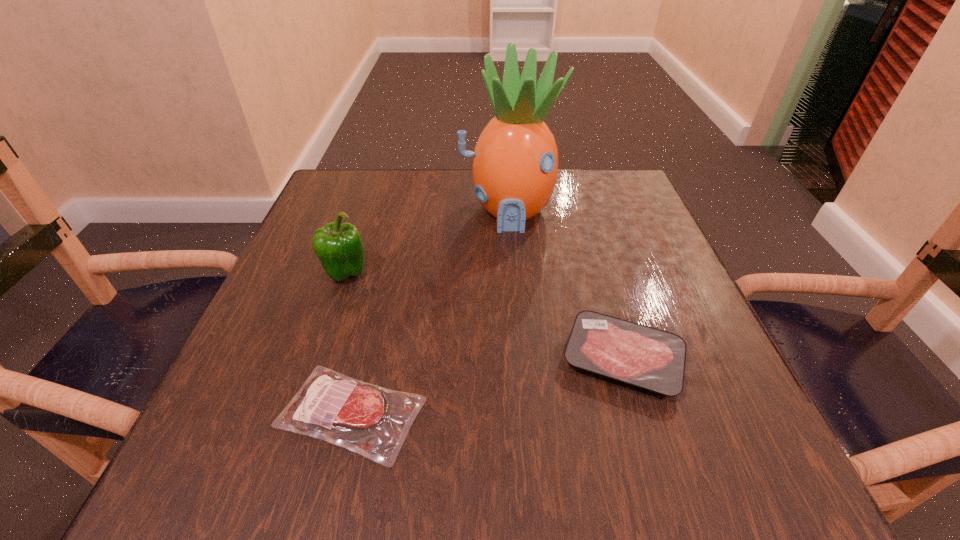
Image resolution: width=960 pixels, height=540 pixels. Find the location of `object that is positioned at the far edge`. object that is positioned at the far edge is located at coordinates (514, 168).

This screenshot has width=960, height=540. What are the coordinates of `object that is at the near edge` in the screenshot? It's located at (373, 421).

Locate an element on the screen. bell pepper situated at the left edge is located at coordinates (339, 247).

I want to click on steak present at the left edge, so click(373, 421).

At what (x,y) coordinates should I click in order to perform the action: click on object at the right edge. Please return your answer as a coordinate pair (x, y). Looking at the image, I should click on (648, 358).

Identify the location of object that is at the near left corner. (373, 421).

Where is `vacant space at the far edge of the desktop`? vacant space at the far edge of the desktop is located at coordinates (429, 190).

Where is `free spot at the near edge of the desktop`? The image size is (960, 540). free spot at the near edge of the desktop is located at coordinates (651, 495).

The image size is (960, 540). What are the coordinates of `free region at the left edge of the desktop` in the screenshot? It's located at (332, 366).

In the image, there is a desktop. Identify the location of vacant space at the right edge. (629, 237).